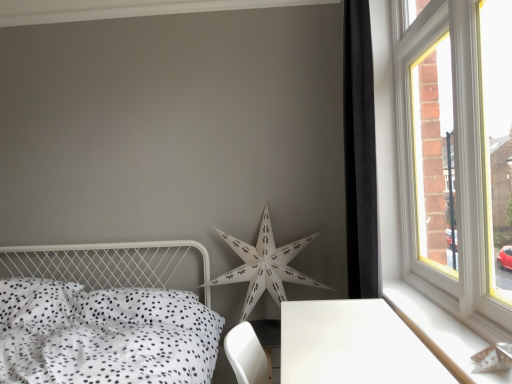
Question: Considering the relative positions of white paper star at center and black velvet curtain at right in the image provided, is white paper star at center to the left of black velvet curtain at right from the viewer's perspective?

Choices:
 (A) no
 (B) yes

Answer: (B)

Question: From a real-world perspective, is white paper star at center physically below black velvet curtain at right?

Choices:
 (A) yes
 (B) no

Answer: (A)

Question: From a real-world perspective, is white paper star at center positioned over black velvet curtain at right based on gravity?

Choices:
 (A) yes
 (B) no

Answer: (B)

Question: Can you confirm if white paper star at center is thinner than black velvet curtain at right?

Choices:
 (A) no
 (B) yes

Answer: (A)

Question: Considering the relative sizes of white paper star at center and black velvet curtain at right in the image provided, is white paper star at center wider than black velvet curtain at right?

Choices:
 (A) yes
 (B) no

Answer: (A)

Question: Is point (346, 89) closer or farther from the camera than point (275, 291)?

Choices:
 (A) closer
 (B) farther

Answer: (A)

Question: From a real-world perspective, is black velvet curtain at right positioned above or below white paper star at center?

Choices:
 (A) below
 (B) above

Answer: (B)

Question: In the image, is black velvet curtain at right positioned in front of or behind white paper star at center?

Choices:
 (A) front
 (B) behind

Answer: (A)

Question: Based on their positions, is black velvet curtain at right located to the left or right of white paper star at center?

Choices:
 (A) left
 (B) right

Answer: (B)

Question: In terms of size, does white glossy table at lower right appear bigger or smaller than white paper star at center?

Choices:
 (A) small
 (B) big

Answer: (A)

Question: Is white glossy table at lower right wider or thinner than white paper star at center?

Choices:
 (A) wide
 (B) thin

Answer: (A)

Question: Considering the relative positions of white glossy table at lower right and white paper star at center in the image provided, is white glossy table at lower right to the left or to the right of white paper star at center?

Choices:
 (A) left
 (B) right

Answer: (B)

Question: In terms of height, does white glossy table at lower right look taller or shorter compared to white paper star at center?

Choices:
 (A) tall
 (B) short

Answer: (B)

Question: From a real-world perspective, is white wood at right positioned above or below white glossy table at lower right?

Choices:
 (A) above
 (B) below

Answer: (A)

Question: Is white wood at right bigger or smaller than white glossy table at lower right?

Choices:
 (A) big
 (B) small

Answer: (B)